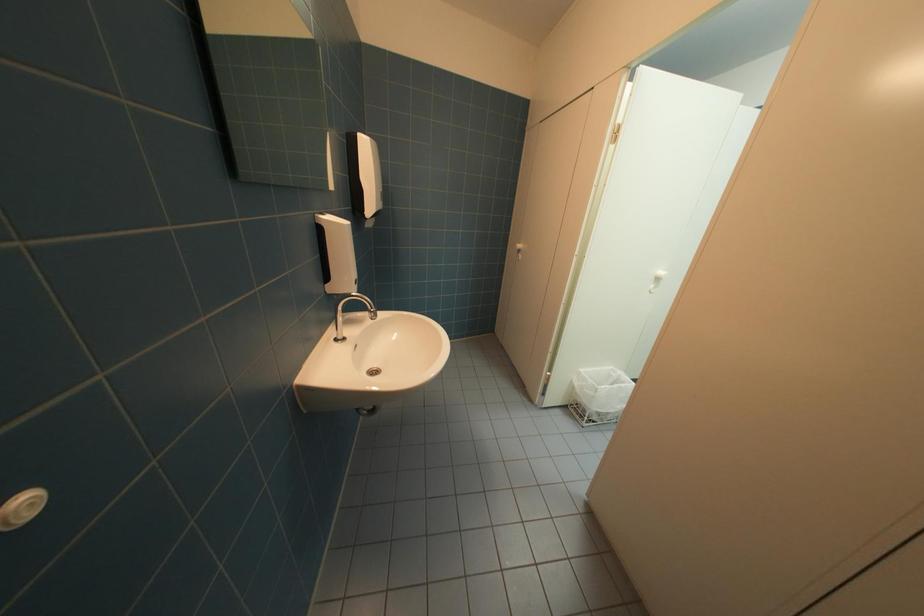
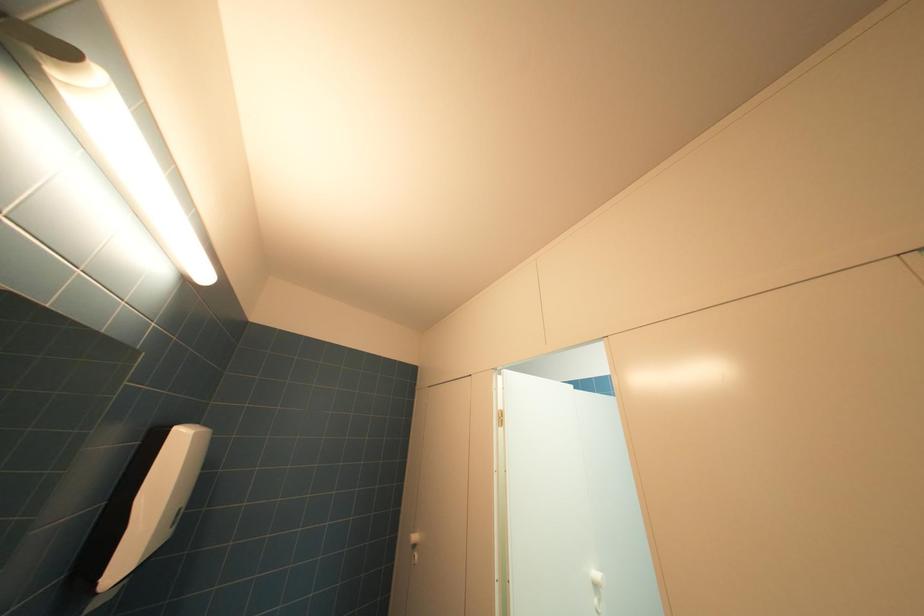
Based on the photo, the images are taken continuously from a first-person perspective. In which direction is your viewpoint rotating?

The camera rotated toward right-up.